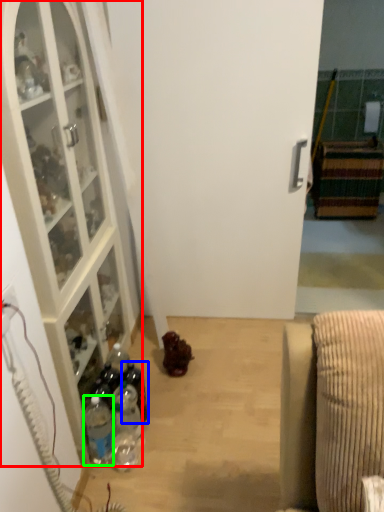
Question: Which is nearer to the cabinetry (highlighted by a red box)? bottle (highlighted by a blue box) or bottle (highlighted by a green box).

Choices:
 (A) bottle
 (B) bottle

Answer: (B)